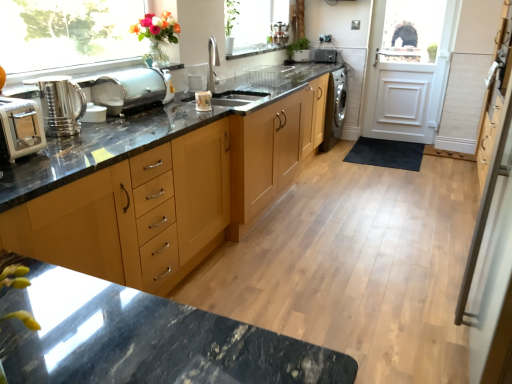
Image resolution: width=512 pixels, height=384 pixels. Find the location of `free spot to the right of white plastic toaster at left`. free spot to the right of white plastic toaster at left is located at coordinates (63, 157).